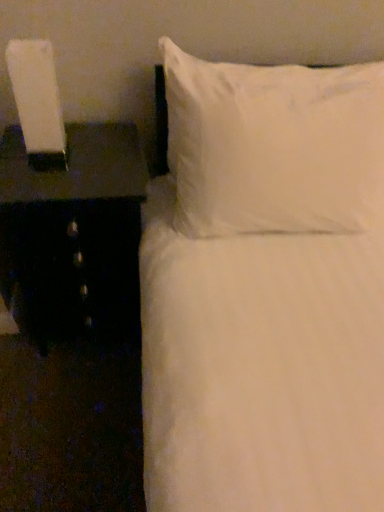
Where is `empty space that is to the right of white glossy lamp at left`? empty space that is to the right of white glossy lamp at left is located at coordinates (82, 165).